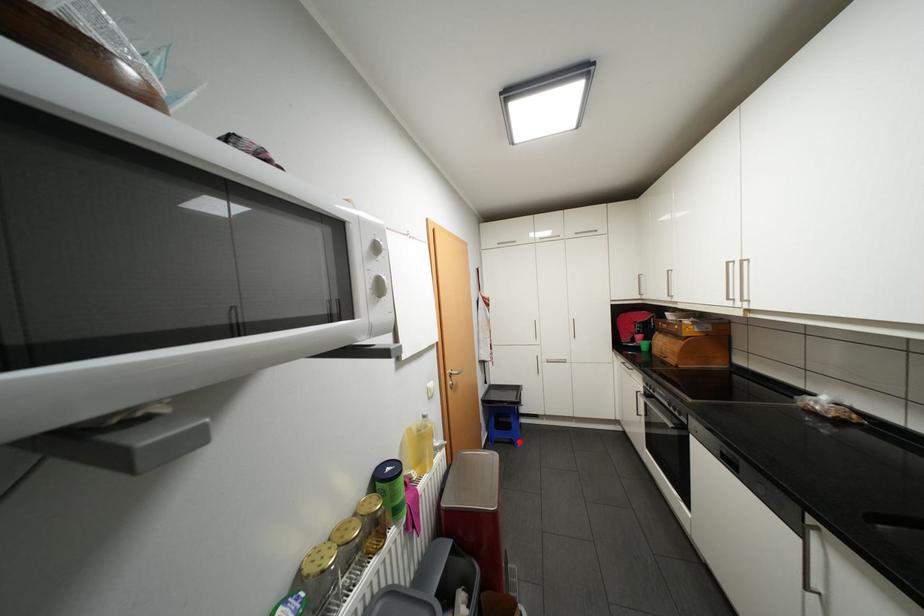
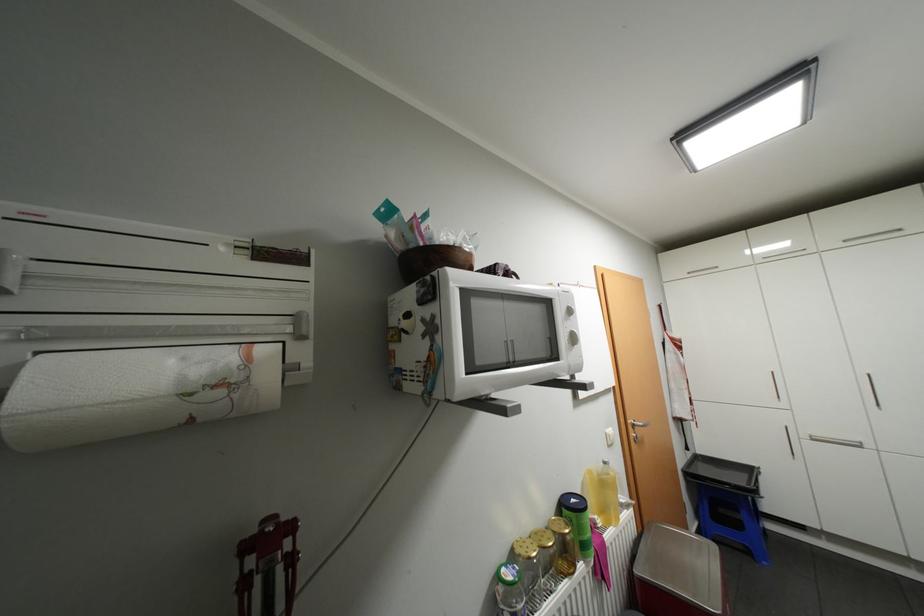
In the second image, find the point that corresponds to the highlighted location in the first image.

(756, 552)